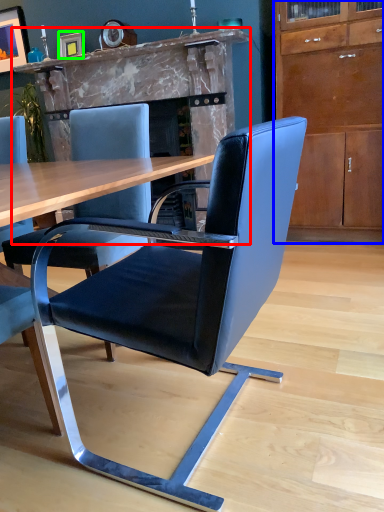
Question: Which object is positioned farthest from fireplace (highlighted by a red box)? Select from cabinetry (highlighted by a blue box) and picture frame (highlighted by a green box).

Choices:
 (A) cabinetry
 (B) picture frame

Answer: (A)